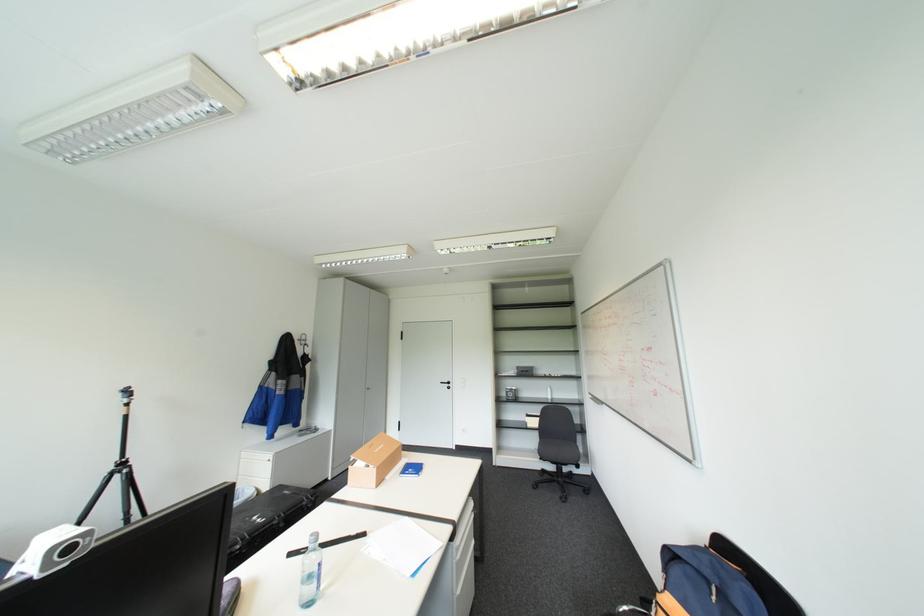
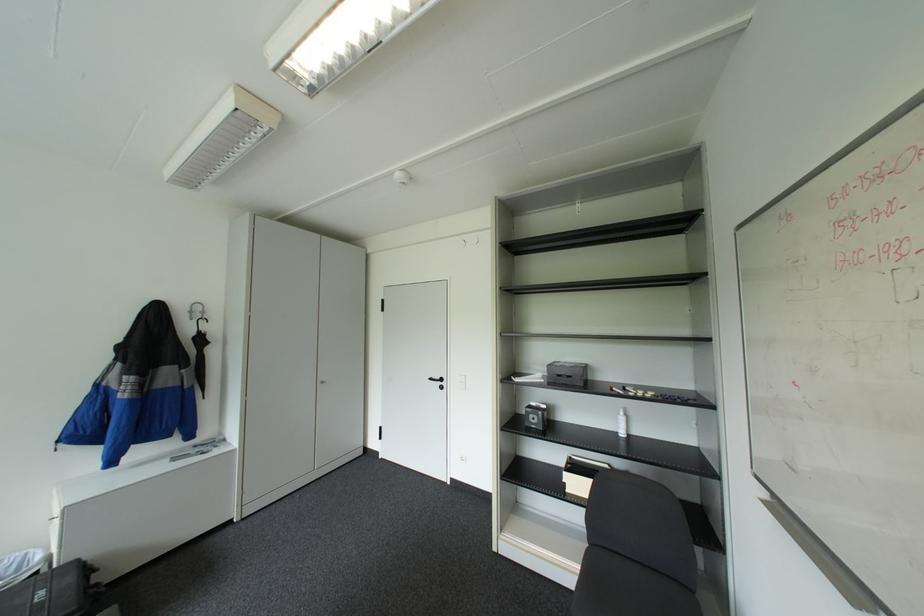
In a continuous first-person perspective shot, in which direction is the camera moving?

The movement direction of the cameraman is right, forward.